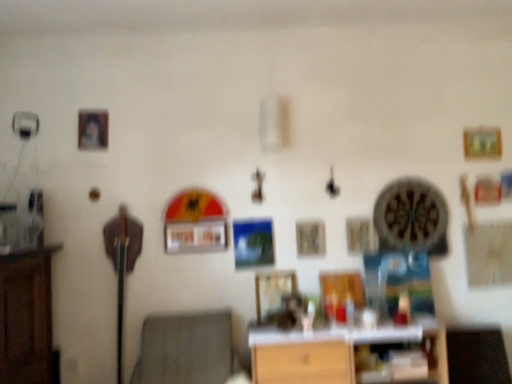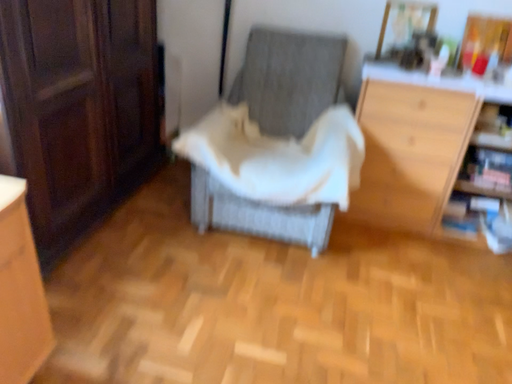
Question: How did the camera likely rotate when shooting the video?

Choices:
 (A) rotated right
 (B) rotated left

Answer: (B)